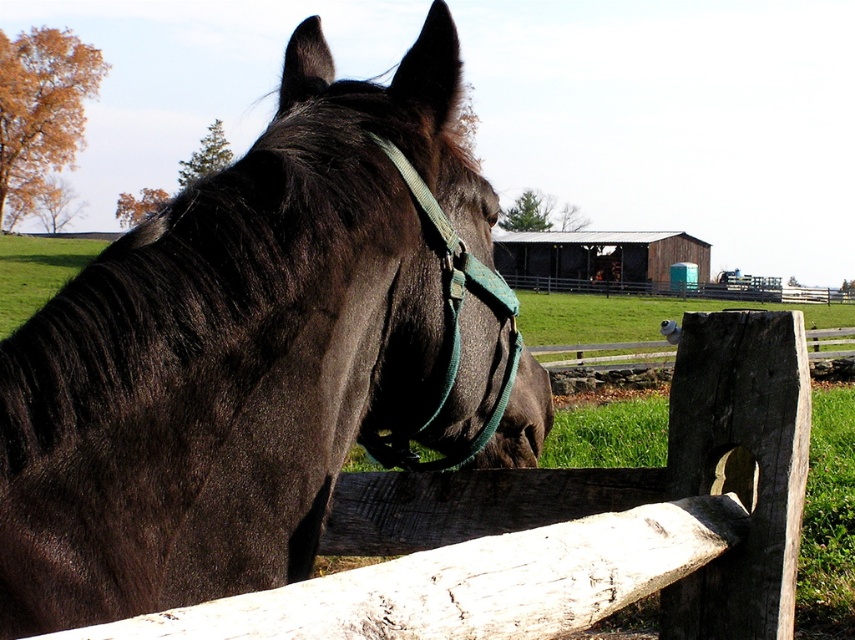
You are a farmer who needs to check the bridle of the horse. You are standing behind the wooden fence. Can you reach the green fabric bridle at center without moving the shiny black horse at center?

The shiny black horse at center is in front of the green fabric bridle at center, so you cannot reach the green fabric bridle at center without moving the shiny black horse at center because it is blocking the bridle.

You are a farmer checking the equipment in the barn. You need to know if the green fabric bridle at center can fit over the shiny black horse at center. Based on their widths, can it fit?

The shiny black horse at center is wider than the green fabric bridle at center, so the bridle may not fit properly over the horse due to its narrower width.